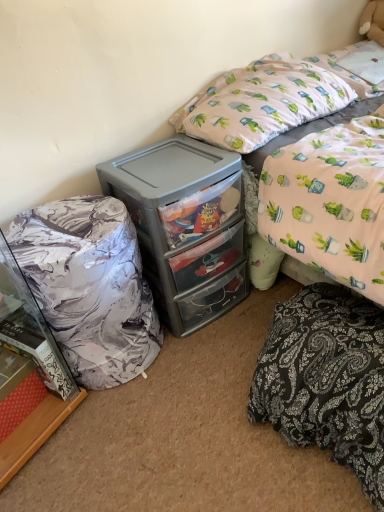
Question: From a real-world perspective, is black paisley fabric at lower right located higher than pink fabric pillow at upper right?

Choices:
 (A) no
 (B) yes

Answer: (A)

Question: Can you confirm if black paisley fabric at lower right is thinner than pink fabric pillow at upper right?

Choices:
 (A) yes
 (B) no

Answer: (B)

Question: Is black paisley fabric at lower right located outside pink fabric pillow at upper right?

Choices:
 (A) yes
 (B) no

Answer: (A)

Question: From a real-world perspective, does black paisley fabric at lower right sit lower than pink fabric pillow at upper right?

Choices:
 (A) yes
 (B) no

Answer: (A)

Question: Does black paisley fabric at lower right have a smaller size compared to pink fabric pillow at upper right?

Choices:
 (A) yes
 (B) no

Answer: (A)

Question: Considering the relative positions of black paisley fabric at lower right and pink fabric pillow at upper right in the image provided, is black paisley fabric at lower right to the right of pink fabric pillow at upper right from the viewer's perspective?

Choices:
 (A) no
 (B) yes

Answer: (B)

Question: Is marble-patterned cabinet at left next to white plush teddy bear at upper right and touching it?

Choices:
 (A) no
 (B) yes

Answer: (A)

Question: Is marble-patterned cabinet at left in front of white plush teddy bear at upper right?

Choices:
 (A) yes
 (B) no

Answer: (A)

Question: Is marble-patterned cabinet at left bigger than white plush teddy bear at upper right?

Choices:
 (A) yes
 (B) no

Answer: (A)

Question: Are marble-patterned cabinet at left and white plush teddy bear at upper right located far from each other?

Choices:
 (A) no
 (B) yes

Answer: (B)

Question: Is marble-patterned cabinet at left looking in the opposite direction of white plush teddy bear at upper right?

Choices:
 (A) yes
 (B) no

Answer: (B)

Question: Does marble-patterned cabinet at left come behind white plush teddy bear at upper right?

Choices:
 (A) yes
 (B) no

Answer: (B)

Question: From the image's perspective, is gray plastic chest of drawers at center located beneath marble-patterned bean bag at left?

Choices:
 (A) no
 (B) yes

Answer: (A)